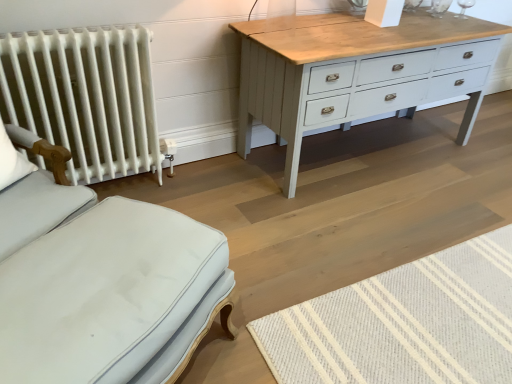
You are a GUI agent. You are given a task and a screenshot of the screen. Output one action in this format:
    pyautogui.click(x=<x>, y=<y>)
    Task: Click on the white painted radiator at left
    The image size is (512, 384).
    Given the screenshot: What is the action you would take?
    pyautogui.click(x=85, y=97)

Image resolution: width=512 pixels, height=384 pixels. In order to click on white fabric pillow at left in this screenshot , I will do `click(11, 160)`.

In terms of size, does white painted radiator at left appear bigger or smaller than light blue fabric ottoman at lower left?

Considering their sizes, white painted radiator at left takes up less space than light blue fabric ottoman at lower left.

How distant is white painted radiator at left from light blue fabric ottoman at lower left?

30.08 inches.

Is white painted radiator at left in contact with light blue fabric ottoman at lower left?

white painted radiator at left and light blue fabric ottoman at lower left are clearly separated.

From the image's perspective, does white painted radiator at left appear lower than light blue fabric ottoman at lower left?

No, from the image's perspective, white painted radiator at left is not beneath light blue fabric ottoman at lower left.

Which object is further away from the camera, white fabric pillow at left or white painted radiator at left?

white painted radiator at left is further from the camera.

Can you confirm if white fabric pillow at left is thinner than white painted radiator at left?

Indeed, white fabric pillow at left has a lesser width compared to white painted radiator at left.

Considering the sizes of white fabric pillow at left and white painted radiator at left in the image, is white fabric pillow at left bigger or smaller than white painted radiator at left?

Clearly, white fabric pillow at left is smaller in size than white painted radiator at left.

Considering the relative sizes of white fabric pillow at left and white painted radiator at left in the image provided, is white fabric pillow at left taller than white painted radiator at left?

No, white fabric pillow at left is not taller than white painted radiator at left.

Is white painted radiator at left directly adjacent to white fabric pillow at left?

white painted radiator at left and white fabric pillow at left are not in contact.

Which is in front, white painted radiator at left or white fabric pillow at left?

Positioned in front is white fabric pillow at left.

Looking at this image, which object is wider, white painted radiator at left or white fabric pillow at left?

white painted radiator at left is wider.

Which object is more forward, white fabric pillow at left or natural wool mat at lower right?

Positioned in front is natural wool mat at lower right.

Could natural wool mat at lower right be considered to be inside white fabric pillow at left?

No, white fabric pillow at left does not contain natural wool mat at lower right.

From the picture: Could you tell me if white fabric pillow at left is turned towards natural wool mat at lower right?

No, white fabric pillow at left is not facing towards natural wool mat at lower right.

Is white fabric pillow at left taller than natural wool mat at lower right?

Indeed, white fabric pillow at left has a greater height compared to natural wool mat at lower right.

Can you see white painted radiator at left touching natural wool mat at lower right?

white painted radiator at left and natural wool mat at lower right are not in contact.

How many degrees apart are the facing directions of white painted radiator at left and natural wool mat at lower right?

There is a 92.4-degree angle between the facing directions of white painted radiator at left and natural wool mat at lower right.

Which object is more forward, white painted radiator at left or natural wool mat at lower right?

natural wool mat at lower right is more forward.

Is natural wool mat at lower right situated inside light blue fabric ottoman at lower left or outside?

natural wool mat at lower right is spatially situated outside light blue fabric ottoman at lower left.

From the image's perspective, does natural wool mat at lower right appear lower than light blue fabric ottoman at lower left?

Indeed, from the image's perspective, natural wool mat at lower right is shown beneath light blue fabric ottoman at lower left.

Considering the relative sizes of natural wool mat at lower right and light blue fabric ottoman at lower left in the image provided, is natural wool mat at lower right thinner than light blue fabric ottoman at lower left?

No.

Is light blue fabric ottoman at lower left oriented towards natural wool mat at lower right?

No, light blue fabric ottoman at lower left is not facing towards natural wool mat at lower right.

Is light blue fabric ottoman at lower left at the right side of natural wool mat at lower right?

In fact, light blue fabric ottoman at lower left is to the left of natural wool mat at lower right.

Which object is closer to the camera, light blue fabric ottoman at lower left or natural wool mat at lower right?

light blue fabric ottoman at lower left is more forward.

Locate an element on the screen. This screenshot has height=384, width=512. radiator that is above the light blue fabric ottoman at lower left (from a real-world perspective) is located at coordinates (85, 97).

This screenshot has width=512, height=384. I want to click on radiator that appears below the white fabric pillow at left (from a real-world perspective), so click(85, 97).

Looking at the image, which one is located further to light blue fabric ottoman at lower left, natural wool mat at lower right or white fabric pillow at left?

natural wool mat at lower right is positioned further to the anchor light blue fabric ottoman at lower left.

Considering their positions, is light blue fabric ottoman at lower left positioned closer to white painted radiator at left than natural wool mat at lower right?

light blue fabric ottoman at lower left lies closer to white painted radiator at left than the other object.

From the picture: From the image, which object appears to be farther from white painted radiator at left, natural wool mat at lower right or white fabric pillow at left?

Among the two, natural wool mat at lower right is located further to white painted radiator at left.

Considering their positions, is white fabric pillow at left positioned closer to natural wool mat at lower right than light blue fabric ottoman at lower left?

light blue fabric ottoman at lower left.

When comparing their distances from white fabric pillow at left, does white painted radiator at left or natural wool mat at lower right seem further?

The object further to white fabric pillow at left is natural wool mat at lower right.

Estimate the real-world distances between objects in this image. Which object is further from natural wool mat at lower right, white painted radiator at left or white fabric pillow at left?

Based on the image, white fabric pillow at left appears to be further to natural wool mat at lower right.

Estimate the real-world distances between objects in this image. Which object is closer to light blue fabric ottoman at lower left, white fabric pillow at left or natural wool mat at lower right?

white fabric pillow at left is positioned closer to the anchor light blue fabric ottoman at lower left.

Estimate the real-world distances between objects in this image. Which object is further from natural wool mat at lower right, light blue fabric ottoman at lower left or white fabric pillow at left?

The object further to natural wool mat at lower right is white fabric pillow at left.

At what (x,y) coordinates should I click in order to perform the action: click on radiator situated between white fabric pillow at left and natural wool mat at lower right from left to right. Please return your answer as a coordinate pair (x, y). Looking at the image, I should click on (85, 97).

At what (x,y) coordinates should I click in order to perform the action: click on pillow located between light blue fabric ottoman at lower left and white painted radiator at left in the depth direction. Please return your answer as a coordinate pair (x, y). Looking at the image, I should click on (11, 160).

Find the location of a particular element. Image resolution: width=512 pixels, height=384 pixels. furniture situated between white fabric pillow at left and natural wool mat at lower right from left to right is located at coordinates (101, 282).

What are the coordinates of `furniture between white painted radiator at left and natural wool mat at lower right from left to right` in the screenshot? It's located at (101, 282).